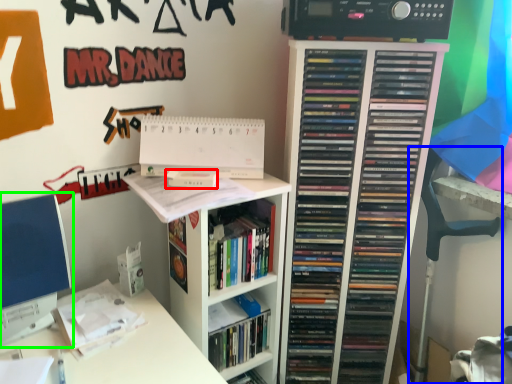
Question: Based on their relative distances, which object is farther from paperback book (highlighted by a red box)? Choose from swivel chair (highlighted by a blue box) and computer monitor (highlighted by a green box).

Choices:
 (A) swivel chair
 (B) computer monitor

Answer: (A)